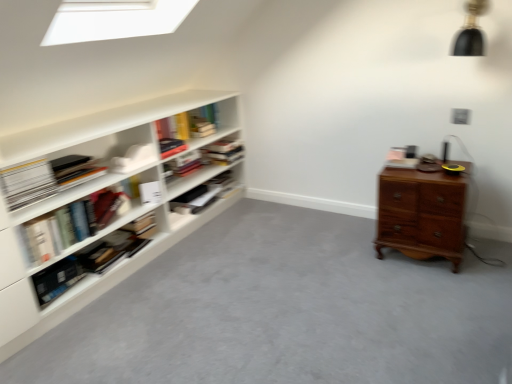
Question: Is matte white bookshelf at center, arranged as the 1th shelf when ordered from the bottom, inside the boundaries of hardcover book at center, marked as the second book in a top-to-bottom arrangement, or outside?

Choices:
 (A) outside
 (B) inside

Answer: (A)

Question: Is matte white bookshelf at center, arranged as the 1th shelf when ordered from the bottom, taller or shorter than hardcover book at center, marked as the second book in a top-to-bottom arrangement?

Choices:
 (A) tall
 (B) short

Answer: (A)

Question: Estimate the real-world distances between objects in this image. Which object is closer to the hardcover book at center, marked as the second book in a top-to-bottom arrangement?

Choices:
 (A) white matte book at left, marked as the 1th paperback book in a front-to-back arrangement
 (B) white matte bookshelf at left, arranged as the second shelf when ordered from the bottom
 (C) hardcover book at left, marked as the 1th book in a bottom-to-top arrangement
 (D) black matte lampshade at upper right
 (E) wooden chest of drawers at right

Answer: (B)

Question: Based on their relative distances, which object is nearer to the hardcover book at left, marked as the 1th book in a bottom-to-top arrangement?

Choices:
 (A) white matte book at left, positioned as the first paperback book in left-to-right order
 (B) white matte paperback book at left, which ranks as the first paperback book in right-to-left order
 (C) black matte lampshade at upper right
 (D) wooden chest of drawers at right
 (E) white matte bookshelf at left, arranged as the second shelf when ordered from the bottom

Answer: (B)